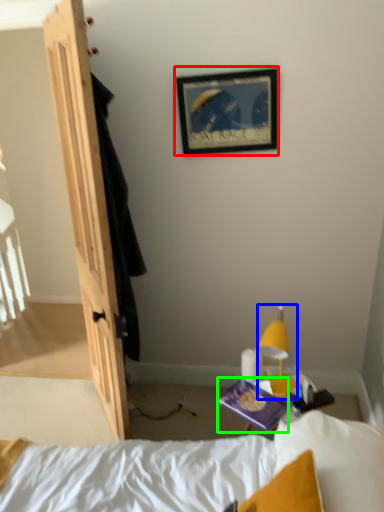
Question: Considering the real-world distances, which object is farthest from picture frame (highlighted by a red box)? light fixture (highlighted by a blue box) or paperback book (highlighted by a green box)?

Choices:
 (A) light fixture
 (B) paperback book

Answer: (B)